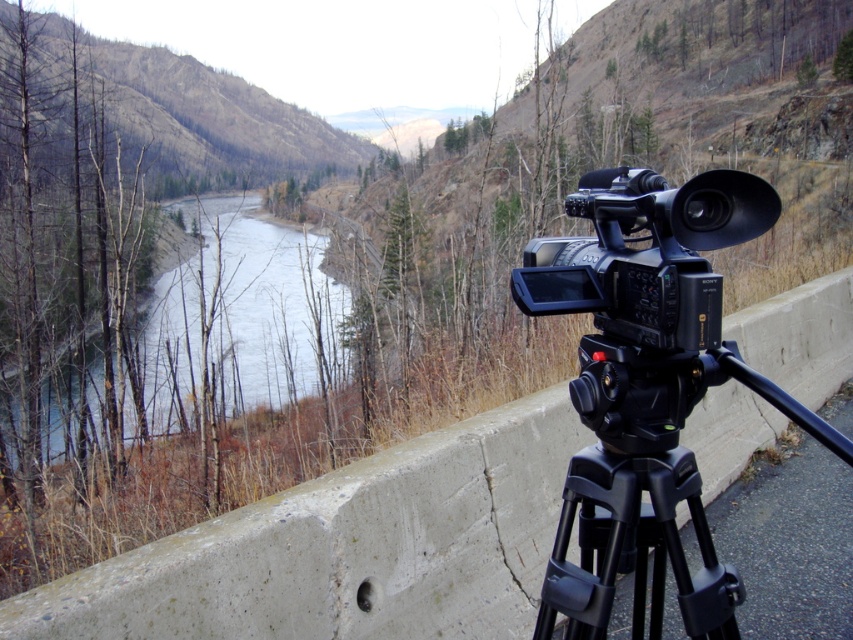
Question: Which point is closer to the camera taking this photo?

Choices:
 (A) (602, 529)
 (B) (758, 202)
 (C) (525, 595)

Answer: (B)

Question: Which of the following is the farthest from the observer?

Choices:
 (A) concrete ledge at center
 (B) black plastic camera at center
 (C) clear water at center

Answer: (C)

Question: Considering the relative positions of clear water at center and black plastic tripod at lower right in the image provided, where is clear water at center located with respect to black plastic tripod at lower right?

Choices:
 (A) below
 (B) above

Answer: (B)

Question: Is concrete ledge at center below black matte tripod at lower right?

Choices:
 (A) no
 (B) yes

Answer: (B)

Question: Is concrete ledge at center above black plastic tripod at lower right?

Choices:
 (A) yes
 (B) no

Answer: (B)

Question: Which object is positioned closest to the clear water at center?

Choices:
 (A) concrete ledge at center
 (B) black plastic tripod at lower right
 (C) black plastic camera at center

Answer: (B)